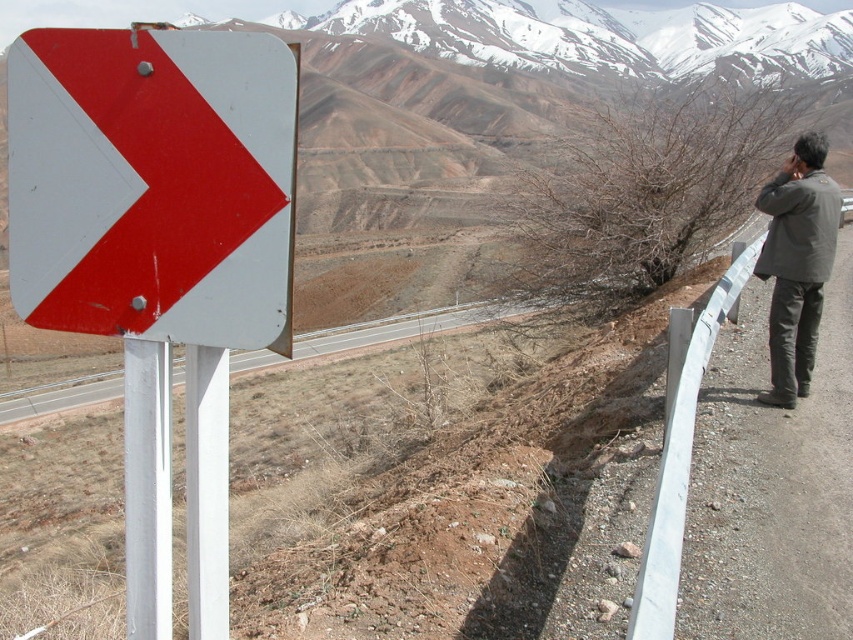
You are a hiker wearing a dark green jacket at right and notice a matte plastic arrow at left pointing towards a trail. Which direction should you follow to stay on the marked path?

The matte plastic arrow at left is positioned on the left side of dark green jacket at right. Since the arrow points towards the trail, you should follow the direction the arrow is pointing to stay on the marked path.